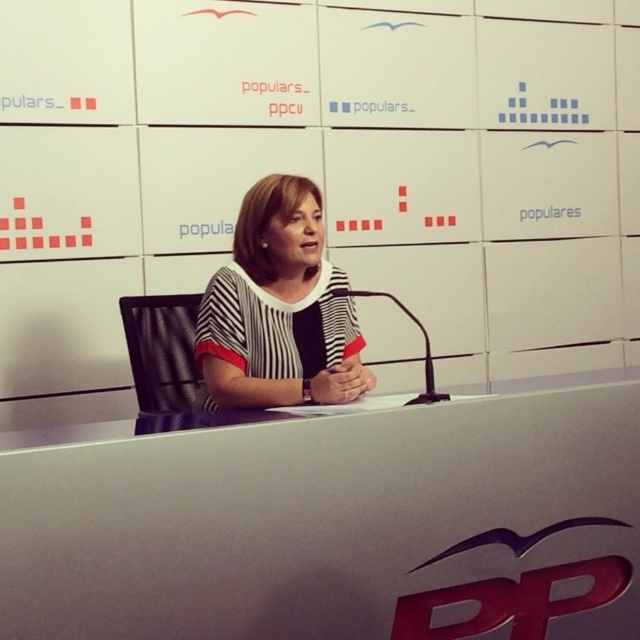
You are a photographer setting up a shot of the woman at the desk. You need to ensure that the white glossy table at center and the striped fabric at center are both visible in the frame. Given their heights, which object will appear lower in the photo?

The white glossy table at center is shorter than the striped fabric at center, so it will appear lower in the photo.

From the picture: You are standing in the press room and see two points marked on the wall. The first point is at coordinates point (61, 620) and the second point is at point (248, 237). Which point is closer to you?

Point (61, 620) is in front of point (248, 237), so the first point is closer to you.

You are a photographer setting up a shoot in this room. You need to place a small camera on the white glossy table at center so that it faces the striped fabric at center. Is the table positioned in a way that allows the camera to directly face the fabric without obstruction?

The white glossy table at center is in front of striped fabric at center, so placing the camera on the table facing the fabric would position it directly towards the fabric without obstruction.